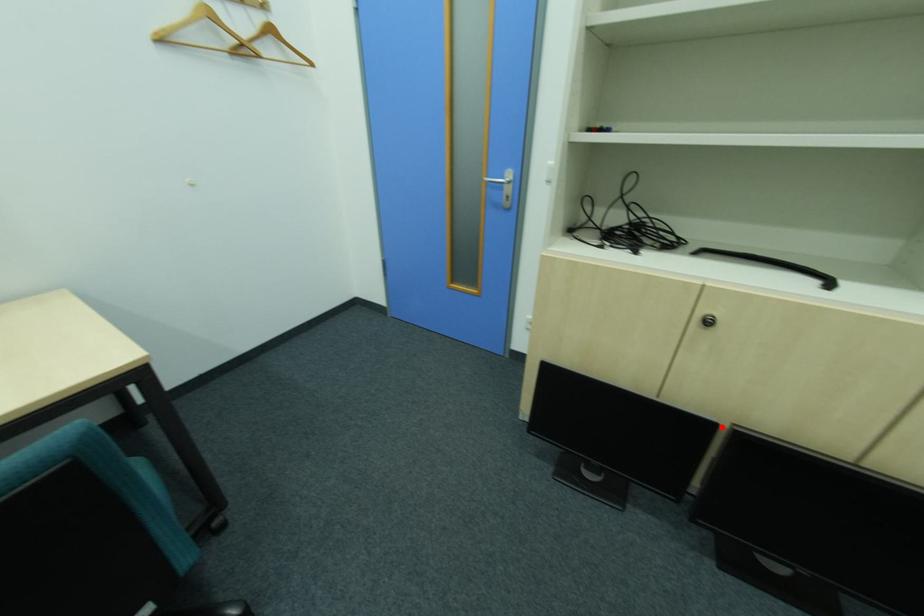
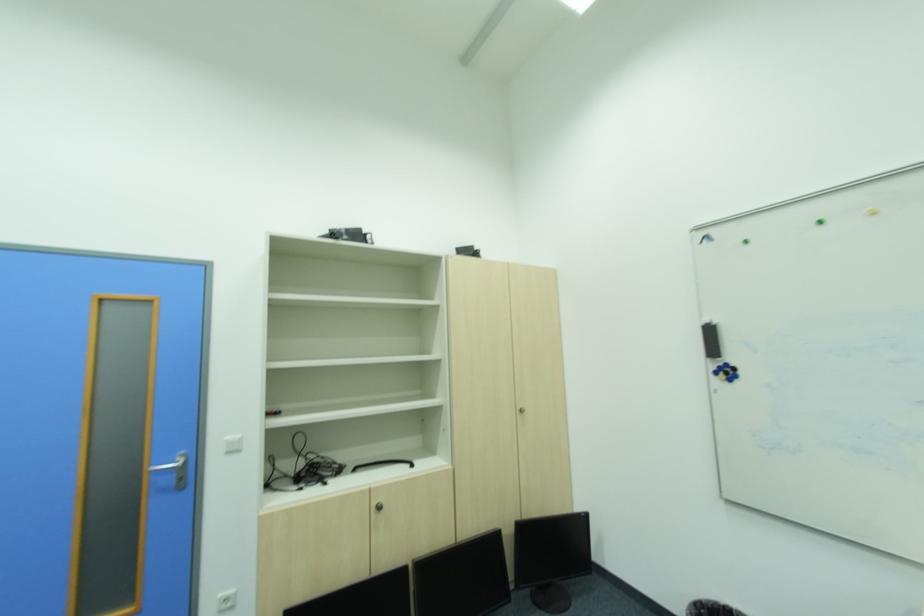
In the second image, find the point that corresponds to the highlighted location in the first image.

(411, 570)